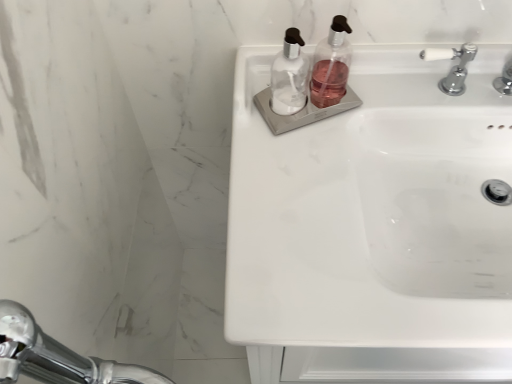
The height and width of the screenshot is (384, 512). In order to click on vacant space situated on the left part of transparent plastic soap dispenser at upper center, which ranks as the second soap dispenser in left-to-right order in this screenshot , I will do `click(251, 104)`.